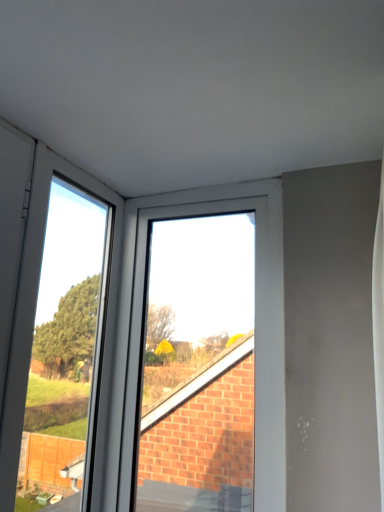
Question: Is transparent glass door at left bigger than white plastic window at upper center?

Choices:
 (A) yes
 (B) no

Answer: (B)

Question: From a real-world perspective, is transparent glass door at left physically below white plastic window at upper center?

Choices:
 (A) no
 (B) yes

Answer: (B)

Question: Considering the relative sizes of transparent glass door at left and white plastic window at upper center in the image provided, is transparent glass door at left smaller than white plastic window at upper center?

Choices:
 (A) yes
 (B) no

Answer: (A)

Question: Could white plastic window at upper center be considered to be inside transparent glass door at left?

Choices:
 (A) yes
 (B) no

Answer: (B)

Question: Does transparent glass door at left come behind white plastic window at upper center?

Choices:
 (A) yes
 (B) no

Answer: (B)

Question: Does transparent glass door at left have a greater width compared to white plastic window at upper center?

Choices:
 (A) no
 (B) yes

Answer: (A)

Question: Considering the relative sizes of white plastic window at upper center and transparent glass door at left in the image provided, is white plastic window at upper center bigger than transparent glass door at left?

Choices:
 (A) no
 (B) yes

Answer: (B)

Question: From a real-world perspective, is white plastic window at upper center positioned under transparent glass door at left based on gravity?

Choices:
 (A) no
 (B) yes

Answer: (A)

Question: Can you confirm if white plastic window at upper center is wider than transparent glass door at left?

Choices:
 (A) yes
 (B) no

Answer: (A)

Question: Is white plastic window at upper center to the right of transparent glass door at left from the viewer's perspective?

Choices:
 (A) yes
 (B) no

Answer: (A)

Question: From the image's perspective, is white plastic window at upper center beneath transparent glass door at left?

Choices:
 (A) no
 (B) yes

Answer: (B)

Question: Can you confirm if white plastic window at upper center is positioned to the left of transparent glass door at left?

Choices:
 (A) yes
 (B) no

Answer: (B)

Question: Based on their sizes in the image, would you say white plastic window at upper center is bigger or smaller than transparent glass door at left?

Choices:
 (A) big
 (B) small

Answer: (A)